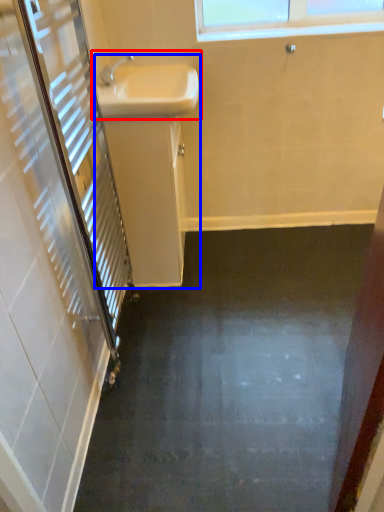
Question: Which of the following is the farthest to the observer, sink (highlighted by a red box) or sink (highlighted by a blue box)?

Choices:
 (A) sink
 (B) sink

Answer: (B)